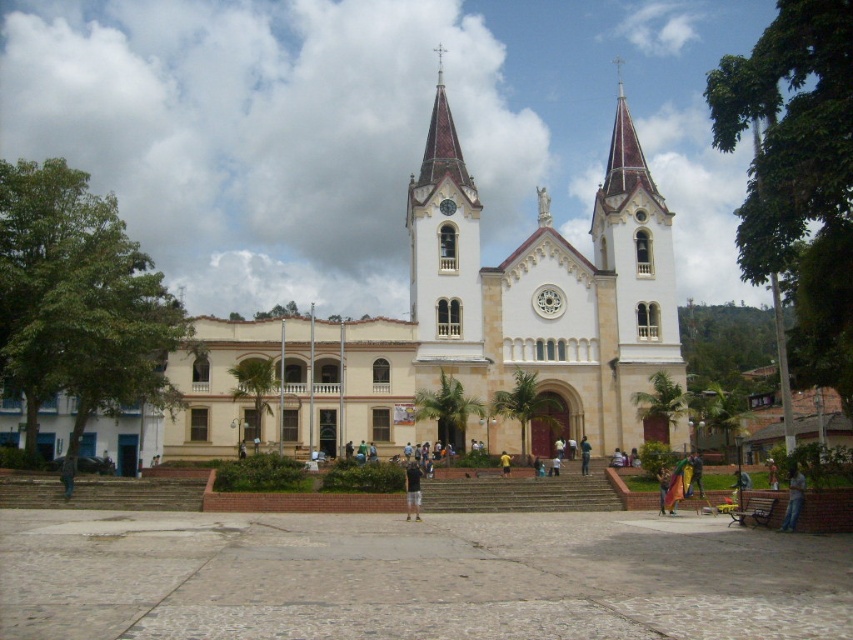
You are standing in the plaza in front of the church and want to walk from the point marked at coordinate point (73, 477) to the point marked at coordinate point (502, 470). According to the image, will you be moving towards the church or away from it?

Point (73, 477) is in front of point (502, 470). Since you are moving from a point in front towards another point behind it relative to the church, you will be moving away from the church.

Based on the photo, you are standing in front of the church and see a brown leather jacket at lower left and a yellow matte shirt at center. Which clothing item appears smaller in size?

The brown leather jacket at lower left is smaller than the yellow matte shirt at center.

You are standing in the plaza in front of the church and want to take a photo that includes both the white stone church at center and the green fabric pants at center. Which object should you position closer to the edge of the frame to ensure both fit in the photo?

Since the white stone church at center is wider than the green fabric pants at center, you should position the green fabric pants at center closer to the edge of the frame to ensure both fit in the photo.